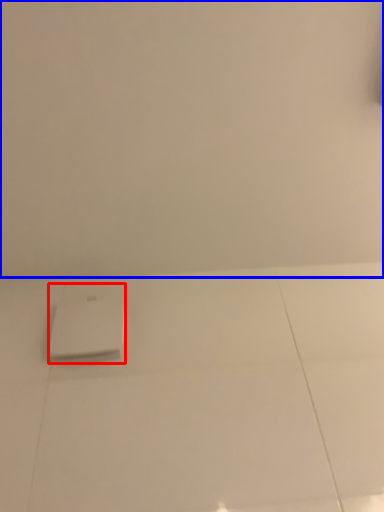
Question: Among these objects, which one is nearest to the camera, home appliance (highlighted by a red box) or backdrop (highlighted by a blue box)?

Choices:
 (A) home appliance
 (B) backdrop

Answer: (B)